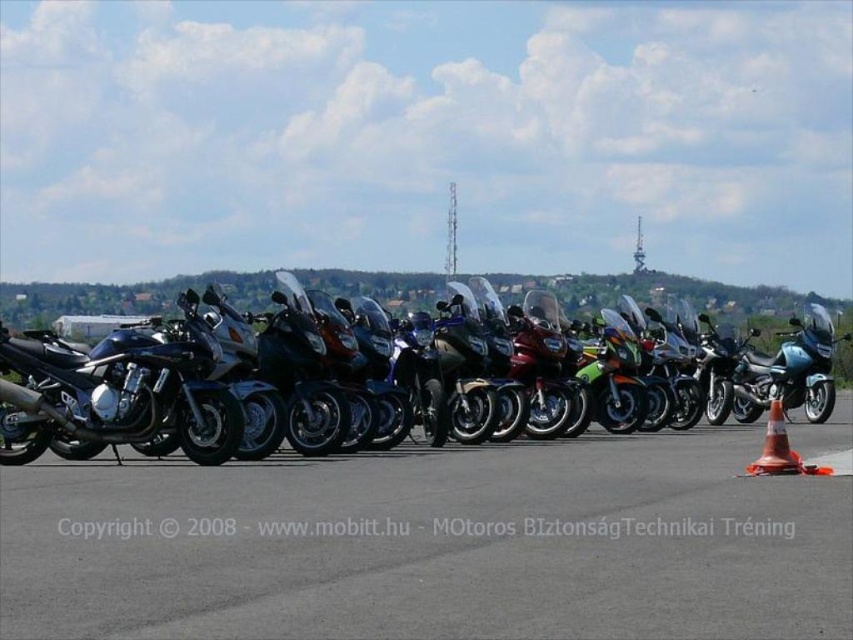
You are a photographer planning to capture a wide shot of the metallic motorcycles at center and the orange reflective cone at lower right. Given their sizes, which object will appear bigger in the photo?

The metallic motorcycles at center will appear bigger in the photo because their width is larger than the orange reflective cone at lower right.

You are standing at the origin point of the coordinate system where the orange traffic cone is located. You want to move towards the metallic motorcycles at center. In which direction should you move relative to the orange traffic cone?

The metallic motorcycles at center are located at coordinate point 0.852 on the x axis and 0.508 on the y axis. Since the orange traffic cone is at the origin point, you should move towards the positive x direction and slightly positive y direction to reach the metallic motorcycles at center.

You are a photographer standing at the front of the scene. You want to capture a shot that includes both the metallic motorcycles at center and the shiny chrome motorcycle at center. Based on their positions, which one will appear lower in the photo?

The metallic motorcycles at center will appear lower in the photo because they are located below the shiny chrome motorcycle at center.